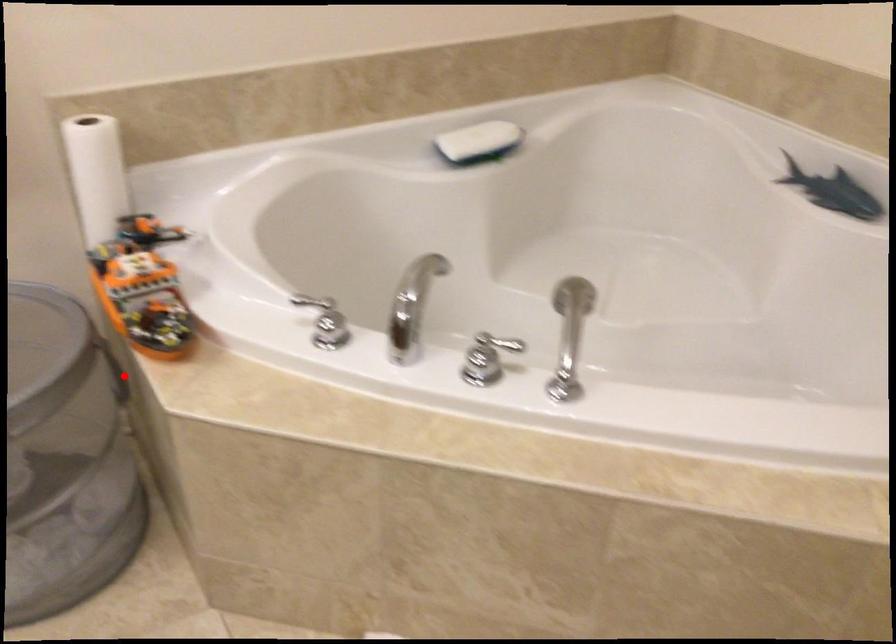
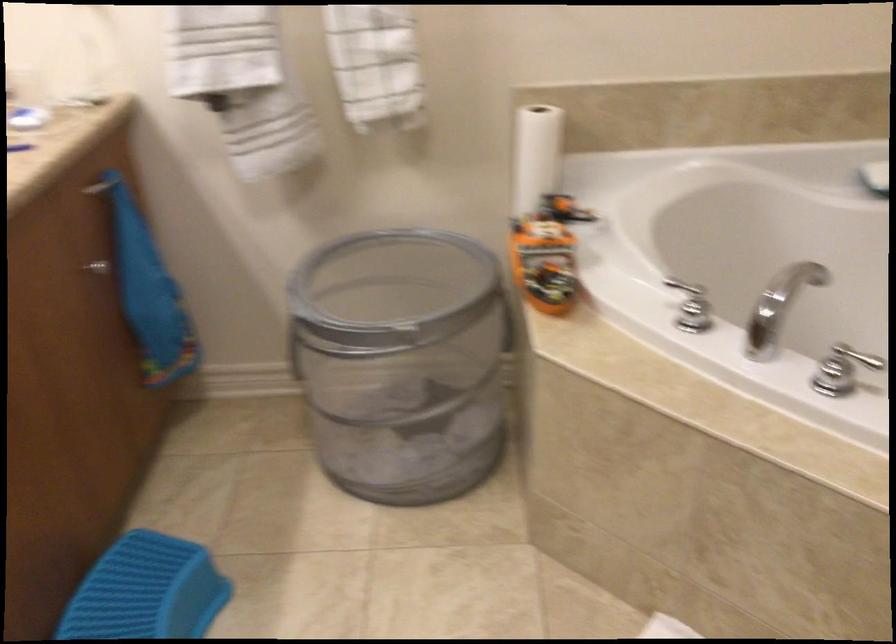
Question: I am providing you with two images of the same scene from different viewpoints. Image1 has a red point marked. In image2, the corresponding 3D location appears at what relative position? Reply with the corresponding letter.

Choices:
 (A) Closer
 (B) Farther

Answer: (B)